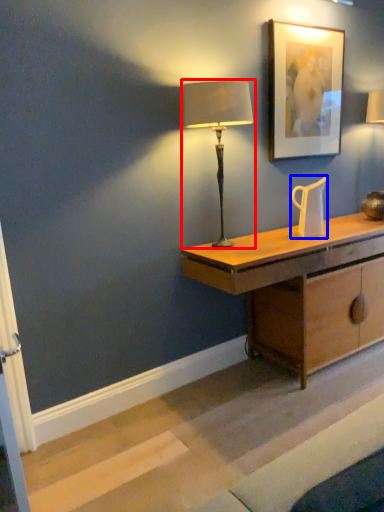
Question: Among these objects, which one is farthest to the camera, lamp (highlighted by a red box) or jug (highlighted by a blue box)?

Choices:
 (A) lamp
 (B) jug

Answer: (B)